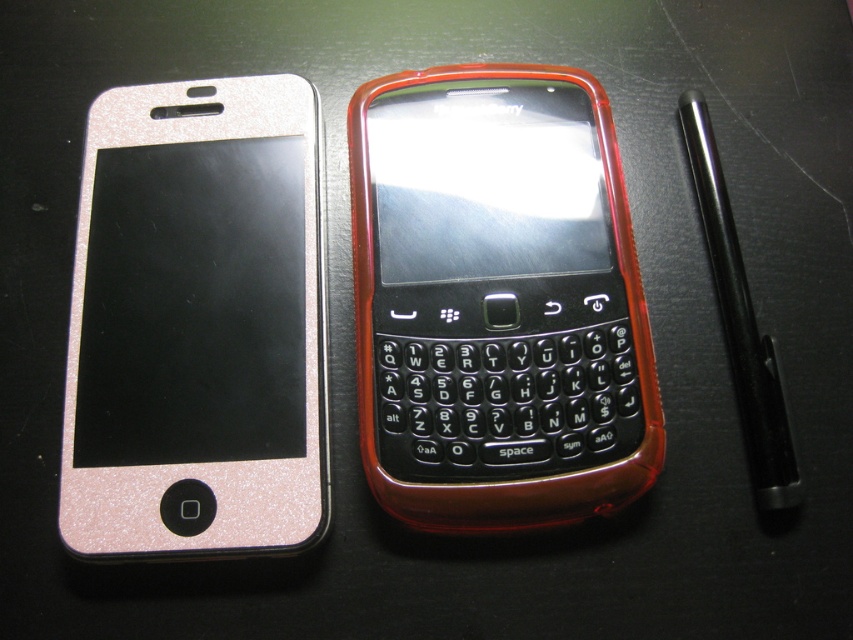
Who is higher up, glittery rose gold phone at left or black metallic pen at right?

Positioned higher is black metallic pen at right.

Is glittery rose gold phone at left closer to the viewer compared to black metallic pen at right?

Yes, glittery rose gold phone at left is closer to the viewer.

I want to click on glittery rose gold phone at left, so click(196, 324).

Identify the location of glittery rose gold phone at left. The height and width of the screenshot is (640, 853). tap(196, 324).

Who is positioned more to the right, translucent red plastic blackberry at center or glittery rose gold phone at left?

Positioned to the right is translucent red plastic blackberry at center.

Does translucent red plastic blackberry at center have a greater height compared to glittery rose gold phone at left?

Yes, translucent red plastic blackberry at center is taller than glittery rose gold phone at left.

Is point (602, 337) farther from camera compared to point (204, 291)?

No, it is in front of (204, 291).

This screenshot has height=640, width=853. What are the coordinates of `translucent red plastic blackberry at center` in the screenshot? It's located at (497, 300).

Is translucent red plastic blackberry at center bigger than black metallic pen at right?

Yes, translucent red plastic blackberry at center is bigger than black metallic pen at right.

Between point (451, 196) and point (744, 388), which one is positioned in front?

Point (744, 388)

Find the location of `translucent red plastic blackberry at center`. translucent red plastic blackberry at center is located at coordinates (497, 300).